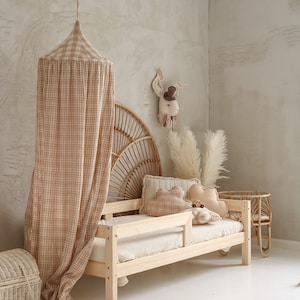
Find the location of `hanging bed cover`. hanging bed cover is located at coordinates (76, 51).